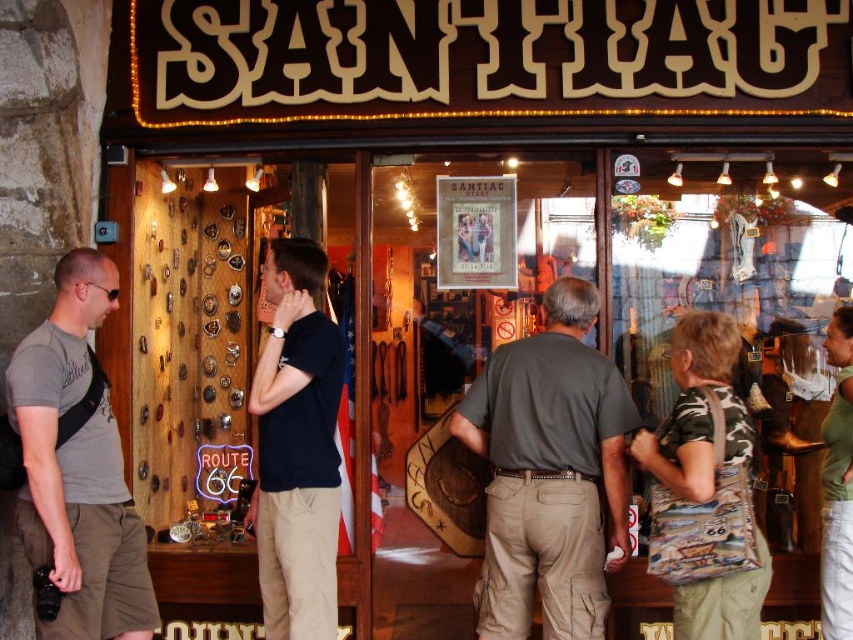
Is point (120, 545) in front of point (320, 474)?

That is True.

Does gray fabric shirt at left appear on the right side of dark blue t-shirt at center?

In fact, gray fabric shirt at left is to the left of dark blue t-shirt at center.

Is point (70, 461) farther from viewer compared to point (328, 378)?

No.

The width and height of the screenshot is (853, 640). What are the coordinates of `gray fabric shirt at left` in the screenshot? It's located at (77, 467).

Does gray fabric shirt at left come in front of green denim jeans at lower right?

Yes.

Who is positioned more to the left, gray fabric shirt at left or green denim jeans at lower right?

gray fabric shirt at left

Find the location of a particular element. gray fabric shirt at left is located at coordinates tap(77, 467).

Who is higher up, khaki cargo pants at center or camouflage fabric bag at lower right?

Positioned higher is camouflage fabric bag at lower right.

Does khaki cargo pants at center come in front of camouflage fabric bag at lower right?

No, it is behind camouflage fabric bag at lower right.

Who is more distant from viewer, [558,300] or [676,332]?

The point [558,300] is behind.

This screenshot has width=853, height=640. Find the location of `khaki cargo pants at center`. khaki cargo pants at center is located at coordinates (549, 472).